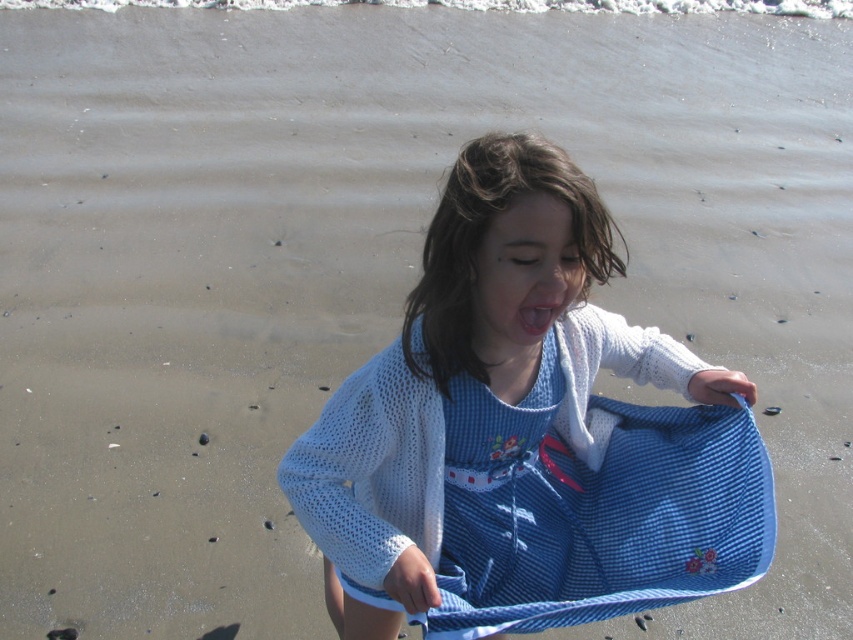
Can you confirm if white mesh sweater at center is thinner than pink glossy lips at center?

No.

Does white mesh sweater at center appear on the right side of pink glossy lips at center?

No, white mesh sweater at center is not to the right of pink glossy lips at center.

Is point (544, 244) positioned before point (560, 307)?

Yes, point (544, 244) is closer to viewer.

This screenshot has height=640, width=853. In order to click on white mesh sweater at center in this screenshot , I will do `click(525, 435)`.